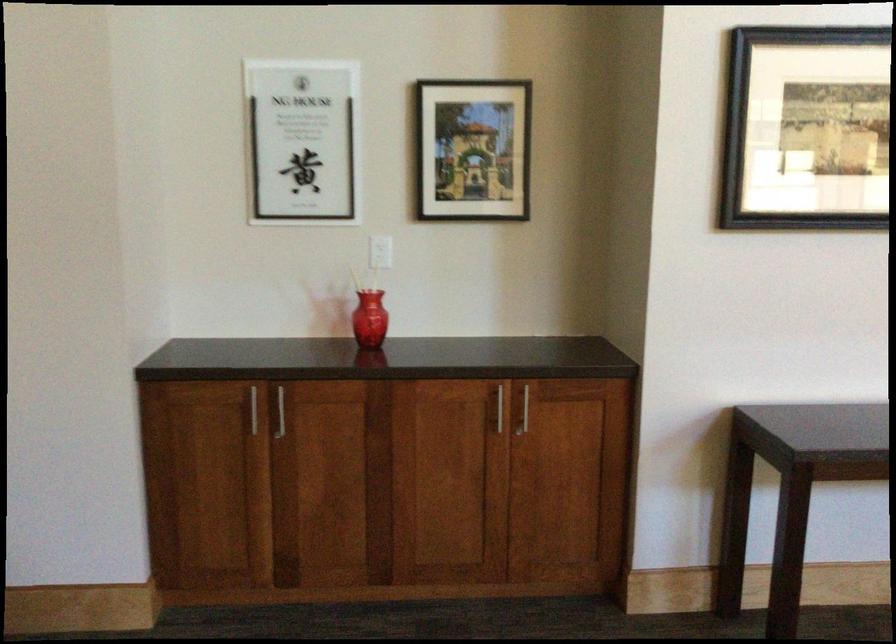
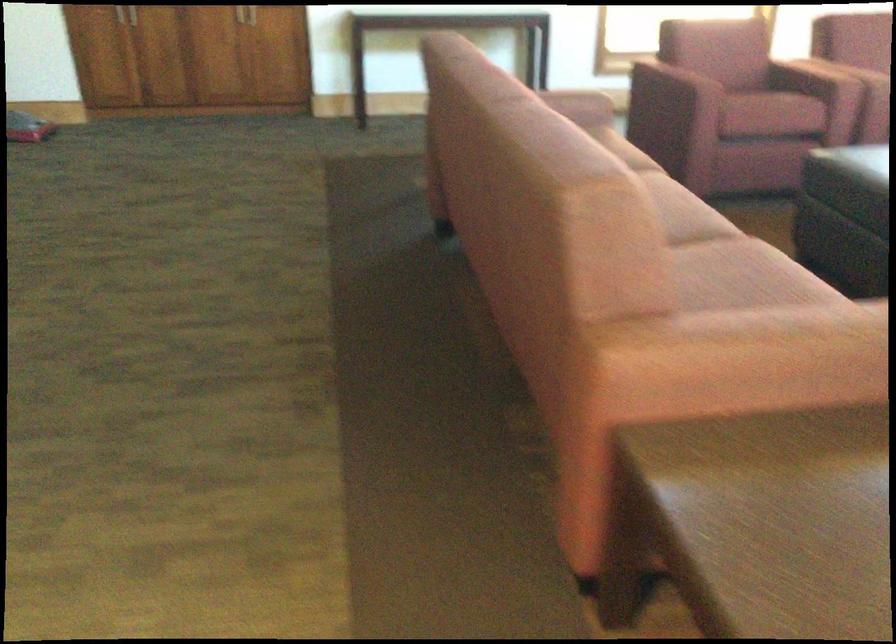
Question: Which direction would the cameraman need to move to produce the second image? Reply with the corresponding letter.

Choices:
 (A) Left
 (B) Right
 (C) Forward
 (D) Backward

Answer: (D)